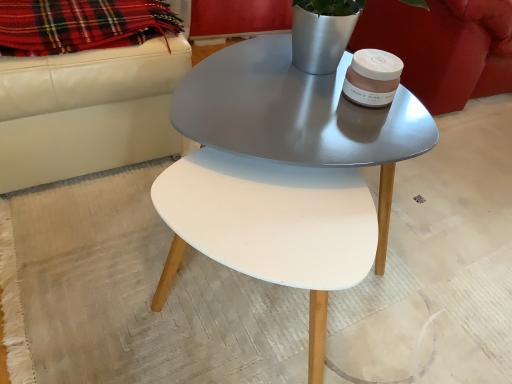
Describe the element at coordinates (298, 117) in the screenshot. I see `metallic gray coffee table at center` at that location.

Image resolution: width=512 pixels, height=384 pixels. Describe the element at coordinates (443, 47) in the screenshot. I see `velvet red armchair at upper right` at that location.

The width and height of the screenshot is (512, 384). Identify the location of plaid wool blanket at upper left. (81, 25).

Considering the positions of points (455, 31) and (248, 96), is point (455, 31) closer to camera compared to point (248, 96)?

No, (455, 31) is further to viewer.

Is velvet red armchair at upper right not inside metallic gray coffee table at center?

Yes, velvet red armchair at upper right is not within metallic gray coffee table at center.

Considering the relative sizes of velvet red armchair at upper right and metallic gray coffee table at center in the image provided, is velvet red armchair at upper right thinner than metallic gray coffee table at center?

No, velvet red armchair at upper right is not thinner than metallic gray coffee table at center.

In terms of size, does velvet red armchair at upper right appear bigger or smaller than metallic gray coffee table at center?

In the image, velvet red armchair at upper right appears to be larger than metallic gray coffee table at center.

Is metallic gray coffee table at center bigger or smaller than velvet red armchair at upper right?

Clearly, metallic gray coffee table at center is smaller in size than velvet red armchair at upper right.

The width and height of the screenshot is (512, 384). In order to click on coffee table that is below the velvet red armchair at upper right (from the image's perspective) in this screenshot , I will do `click(298, 117)`.

Can you confirm if metallic gray coffee table at center is positioned to the right of velvet red armchair at upper right?

No.

Is point (275, 105) positioned in front of point (442, 78)?

Yes, it is.

Between point (69, 1) and point (333, 93), which one is positioned in front?

The point (333, 93) is in front.

Based on the photo, from a real-world perspective, between plaid wool blanket at upper left and metallic gray coffee table at center, who is vertically higher?

plaid wool blanket at upper left.

Considering the relative positions of plaid wool blanket at upper left and metallic gray coffee table at center in the image provided, is plaid wool blanket at upper left to the left of metallic gray coffee table at center from the viewer's perspective?

Correct, you'll find plaid wool blanket at upper left to the left of metallic gray coffee table at center.

Which object is wider, plaid wool blanket at upper left or metallic gray coffee table at center?

Wider between the two is metallic gray coffee table at center.

Is metallic gray coffee table at center aimed at plaid wool blanket at upper left?

No, metallic gray coffee table at center does not turn towards plaid wool blanket at upper left.

Which is closer, (x=292, y=80) or (x=157, y=7)?

Point (x=292, y=80) is closer to the camera than point (x=157, y=7).

From a real-world perspective, is metallic gray coffee table at center on plaid wool blanket at upper left?

No, from a real-world perspective, metallic gray coffee table at center is not above plaid wool blanket at upper left.

From the picture: Is there a large distance between metallic gray coffee table at center and plaid wool blanket at upper left?

No, there isn't a large distance between metallic gray coffee table at center and plaid wool blanket at upper left.

Is plaid wool blanket at upper left to the left or to the right of velvet red armchair at upper right in the image?

From the image, it's evident that plaid wool blanket at upper left is to the left of velvet red armchair at upper right.

Between plaid wool blanket at upper left and velvet red armchair at upper right, which one has larger size?

velvet red armchair at upper right.

Does plaid wool blanket at upper left have a lesser width compared to velvet red armchair at upper right?

Yes.

From the image's perspective, is velvet red armchair at upper right located beneath plaid wool blanket at upper left?

No.

From a real-world perspective, between velvet red armchair at upper right and plaid wool blanket at upper left, who is vertically lower?

In real-world perspective, velvet red armchair at upper right is lower.

Considering the relative positions of velvet red armchair at upper right and plaid wool blanket at upper left in the image provided, is velvet red armchair at upper right to the left of plaid wool blanket at upper left from the viewer's perspective?

No.

Which of these two, velvet red armchair at upper right or plaid wool blanket at upper left, is smaller?

plaid wool blanket at upper left is smaller.

This screenshot has width=512, height=384. Find the location of `armchair above the metallic gray coffee table at center (from a real-world perspective)`. armchair above the metallic gray coffee table at center (from a real-world perspective) is located at coordinates (443, 47).

At what (x,y) coordinates should I click in order to perform the action: click on coffee table that appears below the velvet red armchair at upper right (from a real-world perspective). Please return your answer as a coordinate pair (x, y). Looking at the image, I should click on (298, 117).

When comparing their distances from plaid wool blanket at upper left, does velvet red armchair at upper right or metallic gray coffee table at center seem further?

Based on the image, velvet red armchair at upper right appears to be further to plaid wool blanket at upper left.

When comparing their distances from metallic gray coffee table at center, does velvet red armchair at upper right or plaid wool blanket at upper left seem closer?

The object closer to metallic gray coffee table at center is plaid wool blanket at upper left.

From the image, which object appears to be farther from metallic gray coffee table at center, plaid wool blanket at upper left or velvet red armchair at upper right?

The object further to metallic gray coffee table at center is velvet red armchair at upper right.

Looking at the image, which one is located further to velvet red armchair at upper right, metallic gray coffee table at center or plaid wool blanket at upper left?

plaid wool blanket at upper left lies further to velvet red armchair at upper right than the other object.

Considering their positions, is metallic gray coffee table at center positioned further to plaid wool blanket at upper left than velvet red armchair at upper right?

velvet red armchair at upper right is further to plaid wool blanket at upper left.

Based on their spatial positions, is plaid wool blanket at upper left or metallic gray coffee table at center closer to velvet red armchair at upper right?

Among the two, metallic gray coffee table at center is located nearer to velvet red armchair at upper right.

The image size is (512, 384). In order to click on coffee table between plaid wool blanket at upper left and velvet red armchair at upper right in the horizontal direction in this screenshot , I will do `click(298, 117)`.